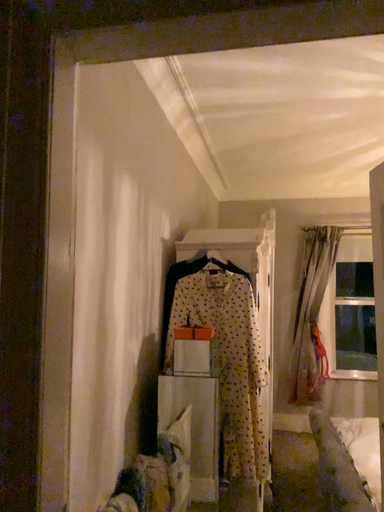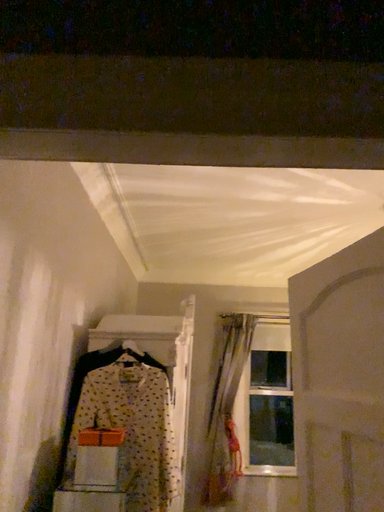
Question: Which way did the camera rotate in the video?

Choices:
 (A) rotated left
 (B) rotated right

Answer: (B)